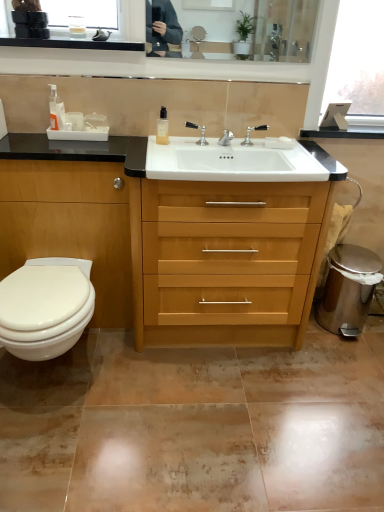
Where is `free spot in front of polished chrome faucet at center`? free spot in front of polished chrome faucet at center is located at coordinates (259, 156).